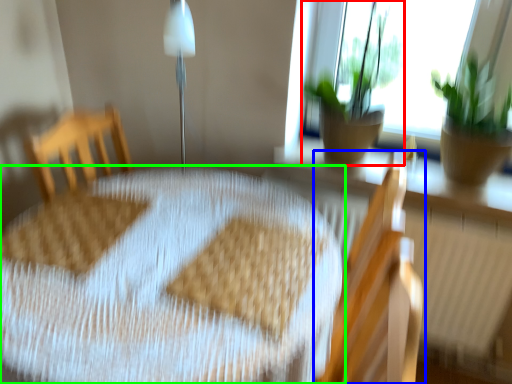
Question: Based on their relative distances, which object is farther from houseplant (highlighted by a red box)? Choose from chair (highlighted by a blue box) and table (highlighted by a green box).

Choices:
 (A) chair
 (B) table

Answer: (B)